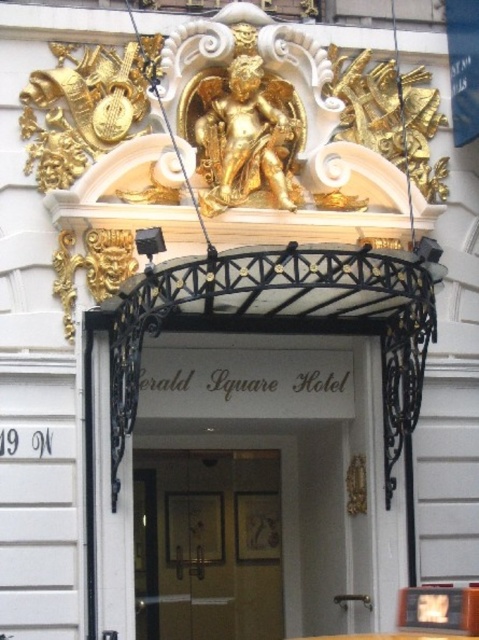
Question: Observing the image, what is the correct spatial positioning of white glossy door at center in reference to wooden door at center?

Choices:
 (A) above
 (B) below

Answer: (A)

Question: Which point is closer to the camera?

Choices:
 (A) (224, 525)
 (B) (186, 620)

Answer: (B)

Question: Does white glossy door at center appear over wooden door at center?

Choices:
 (A) no
 (B) yes

Answer: (B)

Question: Can you confirm if white glossy door at center is smaller than wooden door at center?

Choices:
 (A) no
 (B) yes

Answer: (A)